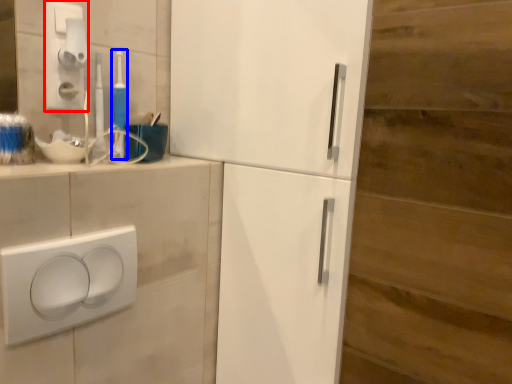
Question: Which of the following is the farthest to the observer, light switch (highlighted by a red box) or toothbrush (highlighted by a blue box)?

Choices:
 (A) light switch
 (B) toothbrush

Answer: (B)